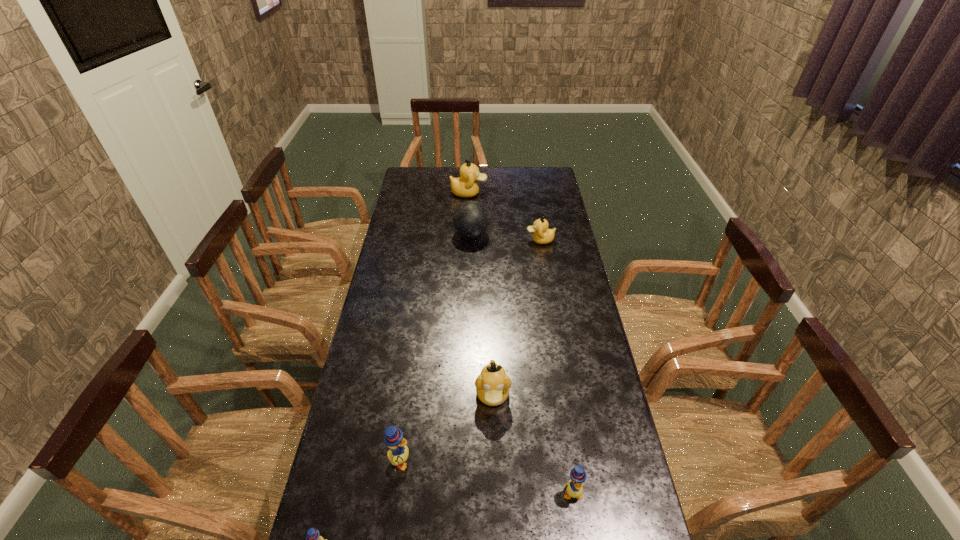
At what (x,y) coordinates should I click in order to perform the action: click on blank area at the left edge. Please return your answer as a coordinate pair (x, y). The width and height of the screenshot is (960, 540). Looking at the image, I should click on (413, 212).

The image size is (960, 540). In the image, there is a desktop. In order to click on free space at the right edge in this screenshot , I will do `click(590, 420)`.

Where is `vacant space at the far left corner of the desktop`? Image resolution: width=960 pixels, height=540 pixels. vacant space at the far left corner of the desktop is located at coordinates coord(430,188).

Where is `blank space at the far right corner`? blank space at the far right corner is located at coordinates (532, 167).

Find the location of `free space between the second yellow duckling from right to left and the bowling ball`. free space between the second yellow duckling from right to left and the bowling ball is located at coordinates (436, 348).

Find the location of a particular element. vacant region between the second nearest yellow duckling and the nearest tan duckling is located at coordinates (532, 444).

Locate an element on the screen. Image resolution: width=960 pixels, height=540 pixels. free space between the nearest tan duckling and the second farthest duckling is located at coordinates (516, 318).

In order to click on vacant space that is in between the fourth nearest object and the rightmost tan duckling in this screenshot , I will do `click(516, 318)`.

I want to click on vacant space in between the second nearest tan duckling and the fourth nearest object, so click(516, 318).

Locate an element on the screen. The width and height of the screenshot is (960, 540). vacant space that's between the sixth farthest object and the second smallest tan duckling is located at coordinates (532, 444).